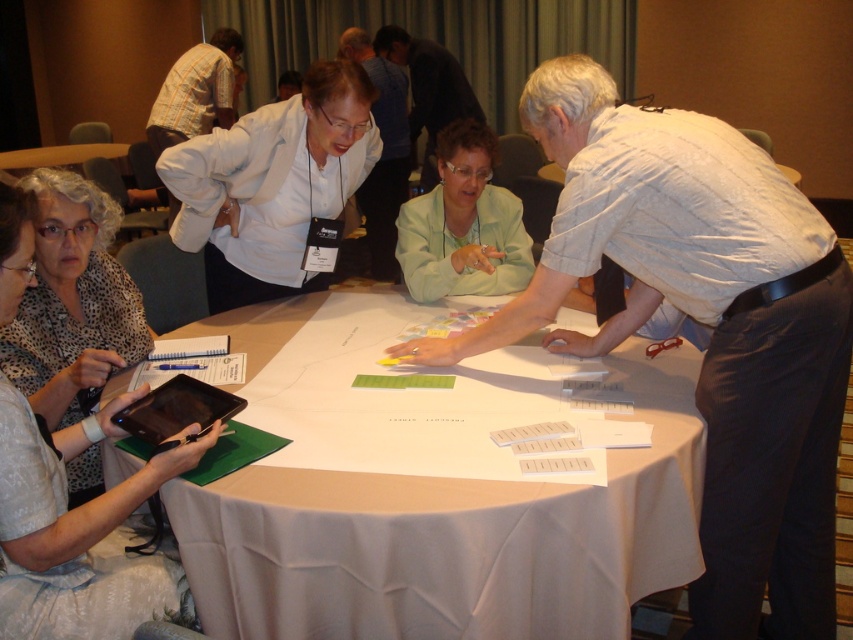
Is point (393, 60) positioned before point (224, 403)?

No, (393, 60) is further to viewer.

Can you confirm if light blue shirt at center is positioned to the left of black glossy tablet at lower left?

No, light blue shirt at center is not to the left of black glossy tablet at lower left.

Between point (419, 120) and point (146, 424), which one is positioned in front?

Point (146, 424)

This screenshot has height=640, width=853. I want to click on light blue shirt at center, so click(428, 90).

Between white matte shirt at upper center and leopard print blouse at lower left, which one appears on the left side from the viewer's perspective?

leopard print blouse at lower left

Between point (352, 61) and point (74, 328), which one is positioned in front?

Point (74, 328)

Between point (306, 163) and point (138, 321), which one is positioned behind?

Point (306, 163)

The width and height of the screenshot is (853, 640). What are the coordinates of `white matte shirt at upper center` in the screenshot? It's located at (273, 186).

Which of these two, white paper at center or white matte jacket at upper center, stands shorter?

Standing shorter between the two is white paper at center.

Which is behind, point (488, 512) or point (403, 164)?

The point (403, 164) is more distant.

Does point (120, 477) come behind point (381, 218)?

That is False.

Find the location of a particular element. The width and height of the screenshot is (853, 640). white paper at center is located at coordinates (451, 540).